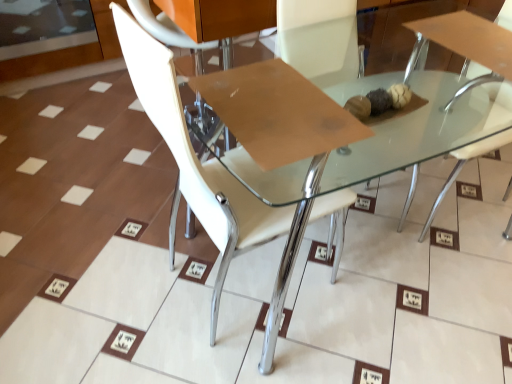
Question: Considering their positions, is brown matte cardboard at center located in front of or behind transparent glass door at upper left?

Choices:
 (A) behind
 (B) front

Answer: (B)

Question: Is brown matte cardboard at center bigger or smaller than transparent glass door at upper left?

Choices:
 (A) big
 (B) small

Answer: (B)

Question: Which is farther from the brown matte cardboard at center?

Choices:
 (A) white glossy chair at upper right, the 2th chair positioned from the left
 (B) transparent glass door at upper left
 (C) white glossy chair at center, the 1th chair in the left-to-right sequence
 (D) clear glass table at center

Answer: (B)

Question: Based on their relative distances, which object is farther from the white glossy chair at upper right, which is the 1th chair from right to left?

Choices:
 (A) white glossy chair at center, which is the second chair in right-to-left order
 (B) brown matte cardboard at center
 (C) transparent glass door at upper left
 (D) clear glass table at center

Answer: (C)